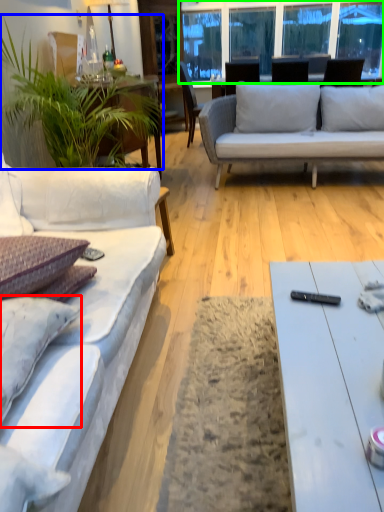
Question: Considering the real-world distances, which object is farthest from pillow (highlighted by a red box)? houseplant (highlighted by a blue box) or window screen (highlighted by a green box)?

Choices:
 (A) houseplant
 (B) window screen

Answer: (B)